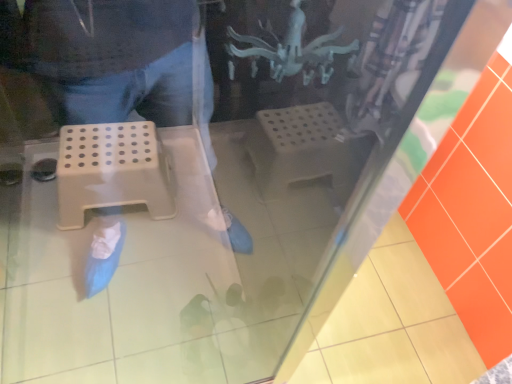
Locate an element on the screen. free space above white plastic step stool at left (from a real-world perspective) is located at coordinates (99, 154).